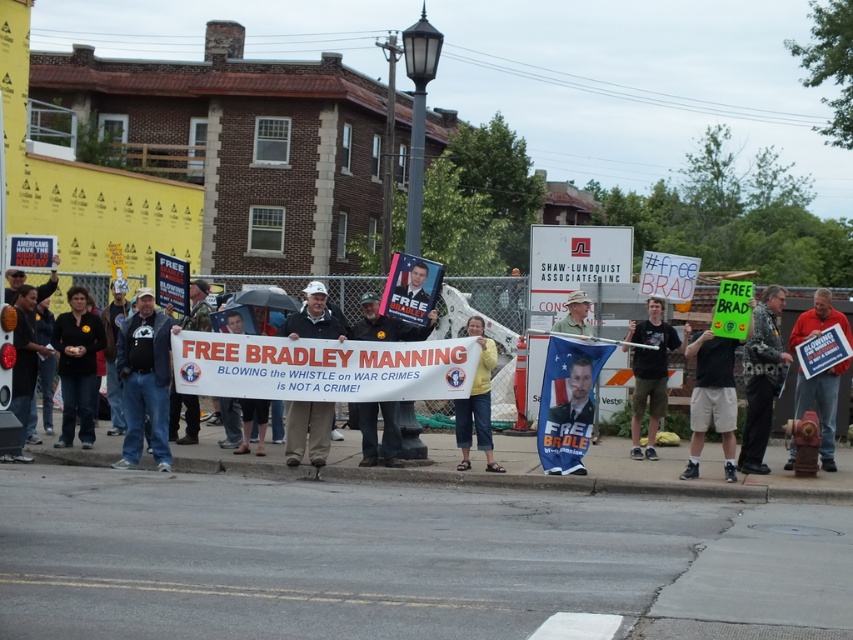
From the picture: You are a photographer standing at the edge of the protest crowd. You want to take a photo that includes both the camouflage jacket at center and the matte black sign at center. The minimum distance between them in the photo must be 10 feet to ensure clarity. Can you capture both objects within this requirement?

The camouflage jacket at center is 11.53 feet from the matte black sign at center. Since 11.53 feet is greater than the required 10 feet minimum distance, yes, you can capture both objects within the requirement.

You are a photographer at the protest. You want to take a photo that includes both the camouflage jacket at center and the matte black sign at center. Which object should you focus on first to ensure both are in frame?

The camouflage jacket at center is bigger than the matte black sign at center, so you should focus on the camouflage jacket at center first to ensure both are in frame.